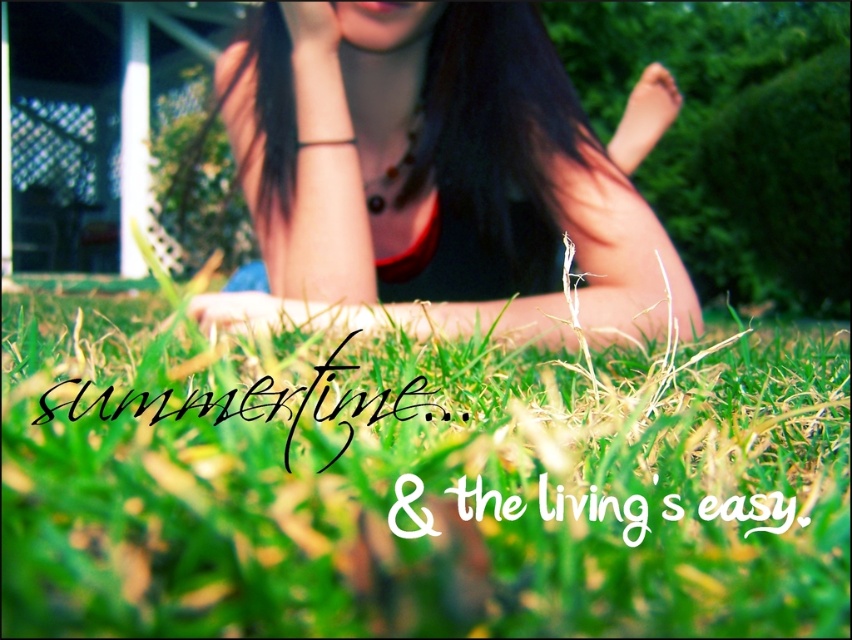
Question: Which of the following is the farthest from the observer?

Choices:
 (A) (331, 316)
 (B) (321, 48)

Answer: (B)

Question: Which of these objects is positioned closest to the matte red tank top at center?

Choices:
 (A) green grass at center
 (B) matte skin hand at upper center

Answer: (A)

Question: Does matte red tank top at center have a greater width compared to matte skin hand at upper center?

Choices:
 (A) yes
 (B) no

Answer: (A)

Question: Is green grass at center further to camera compared to matte skin hand at upper center?

Choices:
 (A) no
 (B) yes

Answer: (A)

Question: Which object appears closest to the camera in this image?

Choices:
 (A) matte red tank top at center
 (B) matte skin hand at upper center
 (C) green grass at center

Answer: (C)

Question: Is green grass at center to the right of matte skin hand at upper center from the viewer's perspective?

Choices:
 (A) yes
 (B) no

Answer: (A)